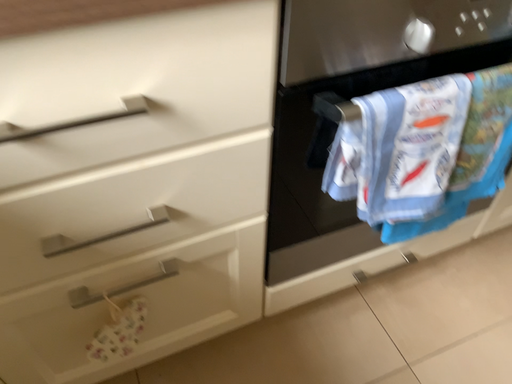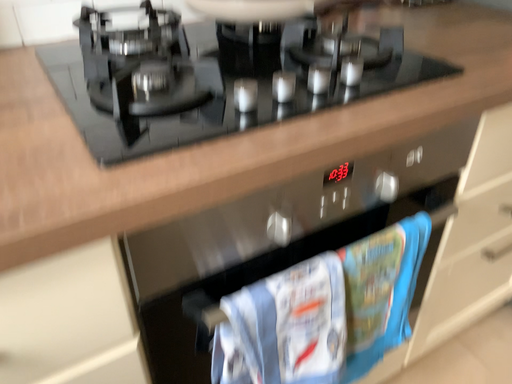
Question: Which way did the camera rotate in the video?

Choices:
 (A) rotated upward
 (B) rotated downward

Answer: (A)